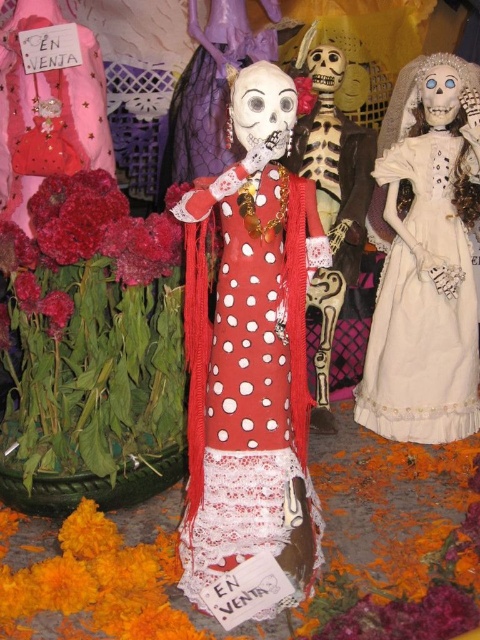
Question: Can you confirm if red polka dot fabric dress at center is wider than matte red flower at center?

Choices:
 (A) yes
 (B) no

Answer: (A)

Question: Which point is farther from the camera taking this photo?

Choices:
 (A) (312, 97)
 (B) (328, 49)
 (C) (382, 307)
 (D) (305, 378)

Answer: (A)

Question: Which object appears closest to the camera in this image?

Choices:
 (A) red polka dot fabric dress at center
 (B) white lace dress at right
 (C) matte red flower at center

Answer: (A)

Question: Is matte polka dot dress at center above matte red flower at center?

Choices:
 (A) no
 (B) yes

Answer: (A)

Question: Which is farther from the red polka dot fabric dress at center?

Choices:
 (A) matte polka dot dress at center
 (B) white lace dress at right

Answer: (A)

Question: Is white lace dress at right smaller than matte polka dot dress at center?

Choices:
 (A) yes
 (B) no

Answer: (A)